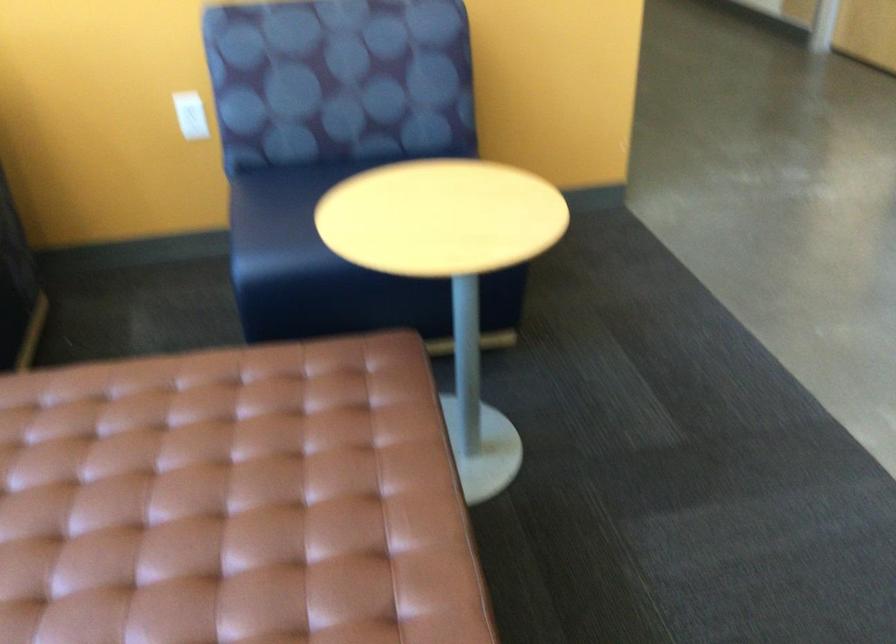
Find the location of a particular element. Image resolution: width=896 pixels, height=644 pixels. chair sitting surface is located at coordinates (231, 502).